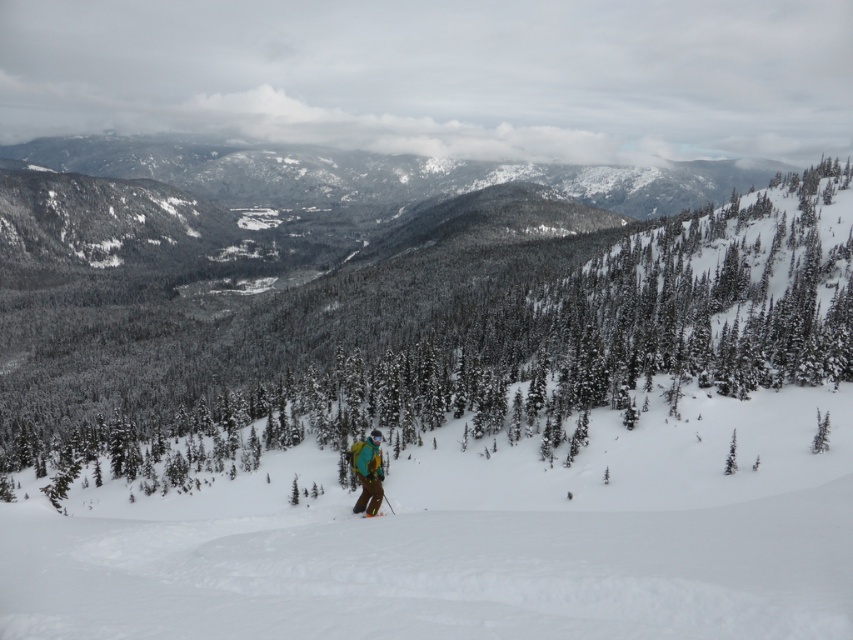
You are standing at the point labeled point (x=358, y=513) and want to move towards the point labeled point (x=519, y=292). Given the slope of the terrain, will you be going uphill or downhill?

Since point (x=519, y=292) is behind point (x=358, y=513), moving towards it would mean going uphill because the slope slopes gently downward towards the valley, so the direction towards the point behind would be ascending.